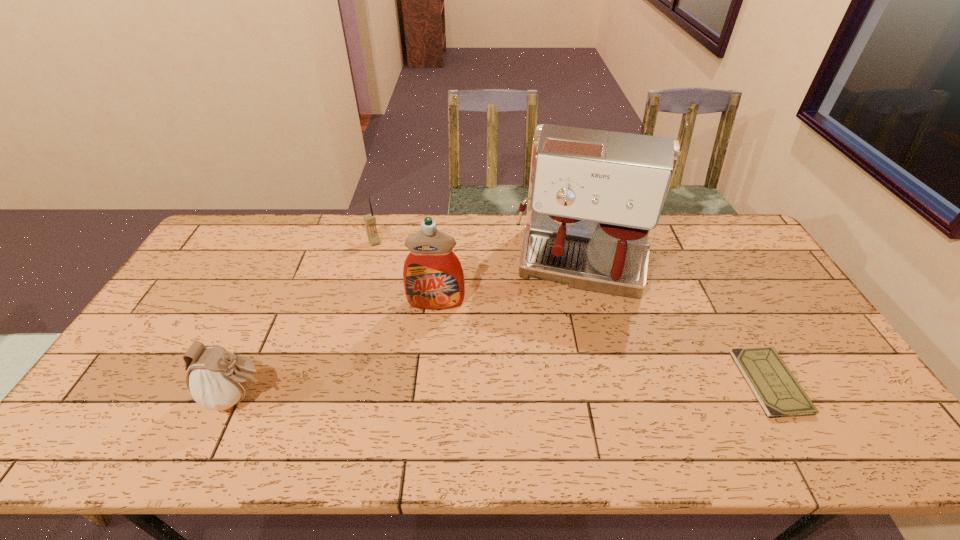
This screenshot has height=540, width=960. I want to click on vacant space located 0.220m on the front of the cellular telephone, where the keypad is located, so click(399, 285).

This screenshot has height=540, width=960. In order to click on vacant space located on the front of the cellular telephone, where the keypad is located in this screenshot , I will do `click(385, 260)`.

At what (x,y) coordinates should I click in order to perform the action: click on free space located 0.340m on the front of the cellular telephone, where the keypad is located. Please return your answer as a coordinate pair (x, y). The image size is (960, 540). Looking at the image, I should click on (415, 309).

You are a GUI agent. You are given a task and a screenshot of the screen. Output one action in this format:
    pyautogui.click(x=<x>, y=<y>)
    Task: Click on the vacant space located on the front surface of the detergent
    Image resolution: width=960 pixels, height=540 pixels.
    Given the screenshot: What is the action you would take?
    pyautogui.click(x=434, y=327)

The height and width of the screenshot is (540, 960). Find the location of `free space located on the front surface of the detergent`. free space located on the front surface of the detergent is located at coordinates (432, 353).

This screenshot has height=540, width=960. Identify the location of vacant area situated 0.300m on the front surface of the detergent. (429, 402).

You are a GUI agent. You are given a task and a screenshot of the screen. Output one action in this format:
    pyautogui.click(x=<x>, y=<y>)
    Task: Click on the vacant area situated 0.300m on the front of the second object from right to left near the spout
    
    Given the screenshot: What is the action you would take?
    pyautogui.click(x=564, y=390)

What are the coordinates of `vacant space located 0.060m on the front of the second object from right to left near the spout` in the screenshot? It's located at (574, 321).

Where is `free spot located on the front of the second object from right to left near the spout`? free spot located on the front of the second object from right to left near the spout is located at coordinates (563, 401).

You are a GUI agent. You are given a task and a screenshot of the screen. Output one action in this format:
    pyautogui.click(x=<x>, y=<y>)
    Task: Click on the cellular telephone present at the far edge
    Image resolution: width=960 pixels, height=540 pixels.
    Given the screenshot: What is the action you would take?
    pyautogui.click(x=370, y=221)